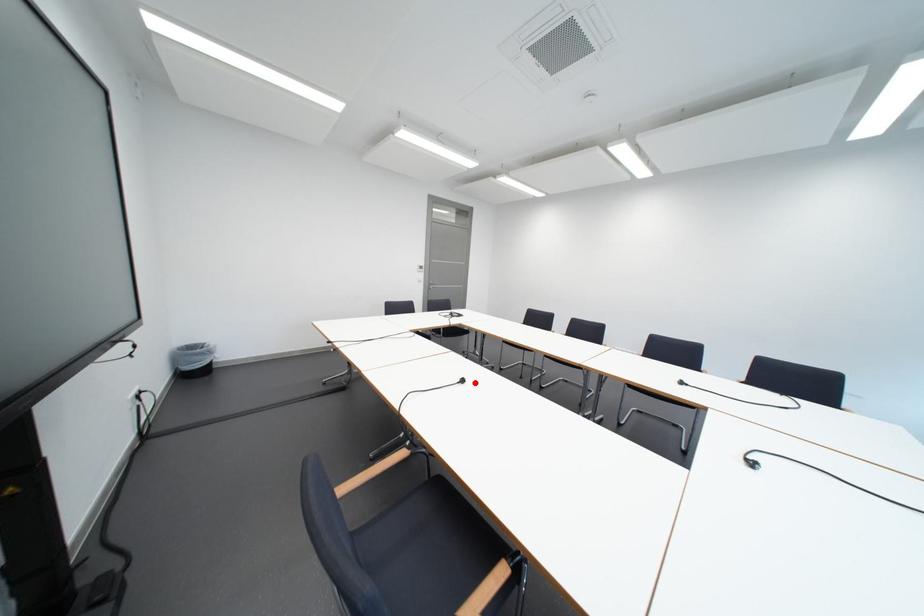
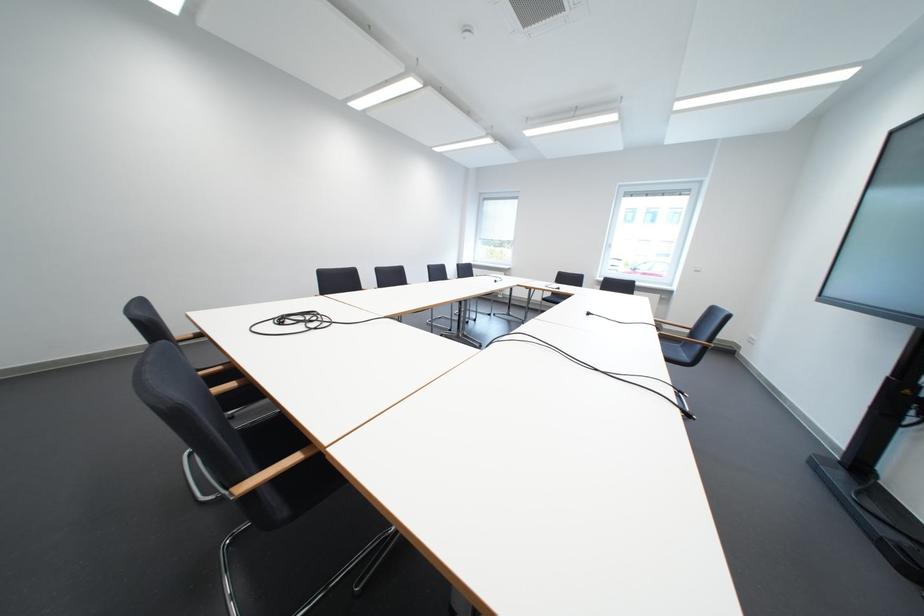
Question: I am providing you with two images of the same scene from different viewpoints. In image1, a red point is highlighted. Considering the same 3D point in image2, which of the following is correct?

Choices:
 (A) It is closer
 (B) It is farther

Answer: (B)